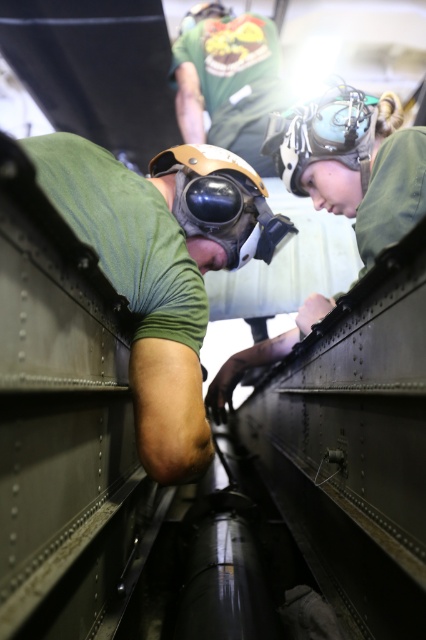
Is point (259, 227) farther from viewer compared to point (242, 173)?

Yes, point (259, 227) is behind point (242, 173).

Is green matte helmet at center further to camera compared to matte black helmet at center?

No, it is in front of matte black helmet at center.

Who is more forward, (169,396) or (219,164)?

Point (169,396)

Where is `green matte helmet at center`? green matte helmet at center is located at coordinates (163, 268).